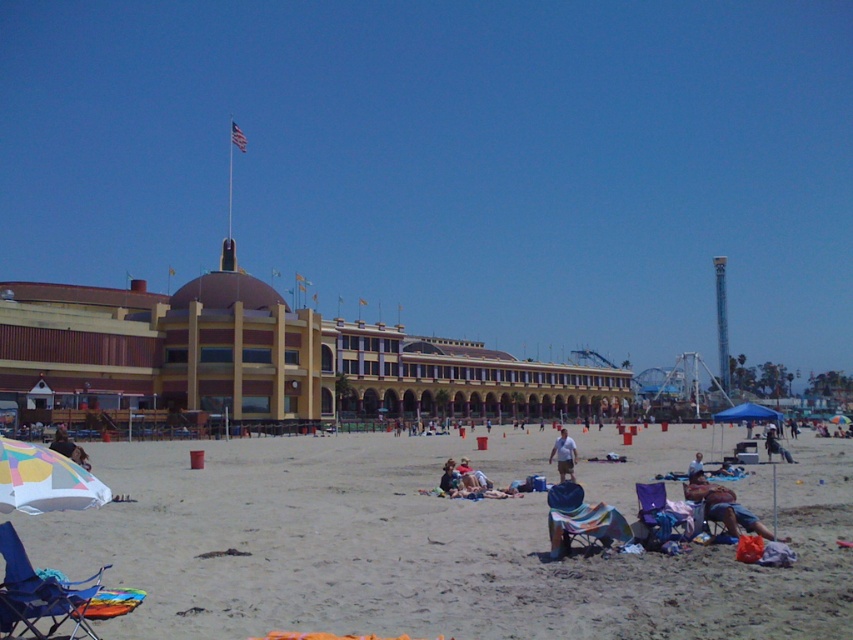
Question: Is blue fabric umbrella at center-right thinner than multicolored fabric umbrella at center?

Choices:
 (A) no
 (B) yes

Answer: (A)

Question: Which point is farther to the camera?

Choices:
 (A) (741, 442)
 (B) (844, 416)

Answer: (B)

Question: Does blue fabric umbrella at center-right appear on the left side of metallic silver chair at center?

Choices:
 (A) no
 (B) yes

Answer: (A)

Question: Considering the relative positions of blue fabric umbrella at center-right and light blue cotton shirt at center in the image provided, where is blue fabric umbrella at center-right located with respect to light blue cotton shirt at center?

Choices:
 (A) right
 (B) left

Answer: (A)

Question: Among these points, which one is farthest from the camera?

Choices:
 (A) (467, 468)
 (B) (575, 449)

Answer: (B)

Question: Among these points, which one is farthest from the camera?

Choices:
 (A) (830, 420)
 (B) (555, 504)
 (C) (695, 628)
 (D) (701, 460)

Answer: (A)